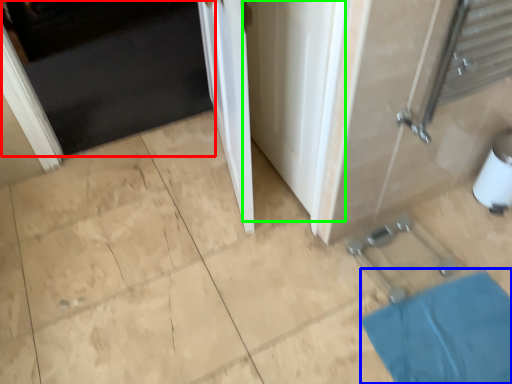
Question: Which object is the closest to the door (highlighted by a red box)? Choose among these: bath mat (highlighted by a blue box) or screen door (highlighted by a green box).

Choices:
 (A) bath mat
 (B) screen door

Answer: (B)